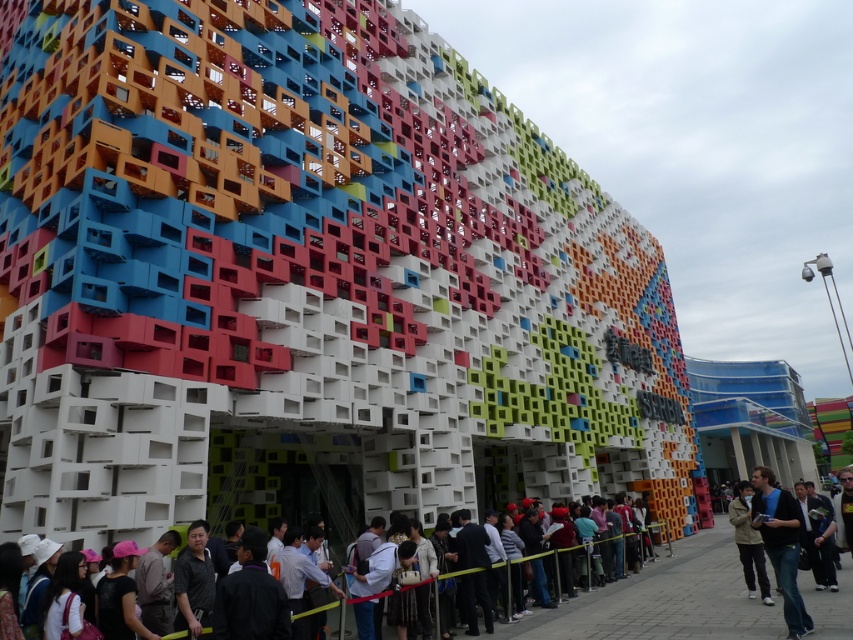
Is dark gray suit at center positioned at the back of khaki cotton jacket at center?

No.

Who is lower down, dark gray suit at center or khaki cotton jacket at center?

Positioned lower is dark gray suit at center.

Who is more forward, (643, 627) or (733, 518)?

Point (643, 627) is in front.

The height and width of the screenshot is (640, 853). I want to click on dark gray suit at center, so click(x=596, y=612).

Is the position of dark blue jeans at lower right less distant than that of khaki cotton jacket at center?

Yes.

Between dark blue jeans at lower right and khaki cotton jacket at center, which one appears on the right side from the viewer's perspective?

khaki cotton jacket at center

Is point (798, 625) closer to camera compared to point (759, 586)?

Yes, it is.

Identify the location of dark blue jeans at lower right. (780, 545).

Is point (509, 634) farther from camera compared to point (795, 595)?

Yes, point (509, 634) is behind point (795, 595).

Consider the image. Measure the distance between point (581, 627) and camera.

21.77 meters

You are a GUI agent. You are given a task and a screenshot of the screen. Output one action in this format:
    pyautogui.click(x=<x>, y=<y>)
    Task: Click on the dark gray suit at center
    
    Given the screenshot: What is the action you would take?
    pyautogui.click(x=596, y=612)